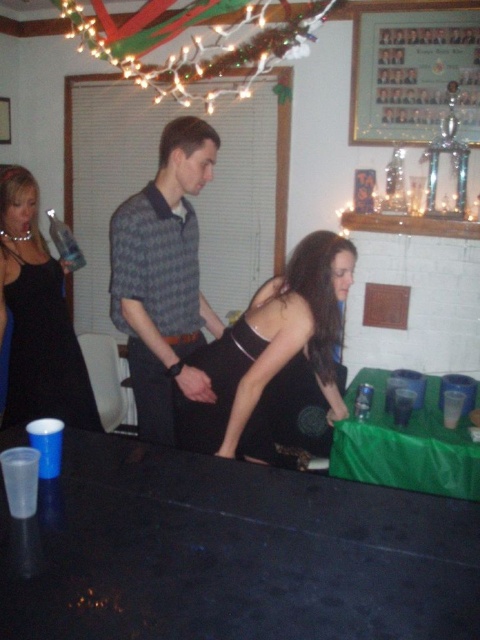
Question: Does gray checkered shirt at center have a smaller size compared to black satin dress at left?

Choices:
 (A) no
 (B) yes

Answer: (A)

Question: Estimate the real-world distances between objects in this image. Which object is farther from the black satin dress at left?

Choices:
 (A) transparent plastic cup at lower right
 (B) metallic trophy at upper right
 (C) clear plastic cup at table center

Answer: (B)

Question: Can you confirm if black satin dress at left is positioned above transparent plastic cup at lower right?

Choices:
 (A) yes
 (B) no

Answer: (A)

Question: Does gray checkered shirt at center appear on the left side of black satin dress at left?

Choices:
 (A) yes
 (B) no

Answer: (B)

Question: Which point is closer to the camera taking this photo?

Choices:
 (A) click(152, 260)
 (B) click(451, 428)

Answer: (A)

Question: Among these points, which one is nearest to the camera?

Choices:
 (A) (327, 246)
 (B) (183, 344)

Answer: (A)